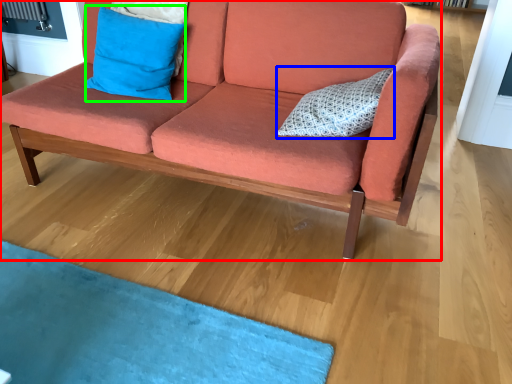
Question: Considering the real-world distances, which object is closest to studio couch (highlighted by a red box)? pillow (highlighted by a blue box) or pillow (highlighted by a green box).

Choices:
 (A) pillow
 (B) pillow

Answer: (A)